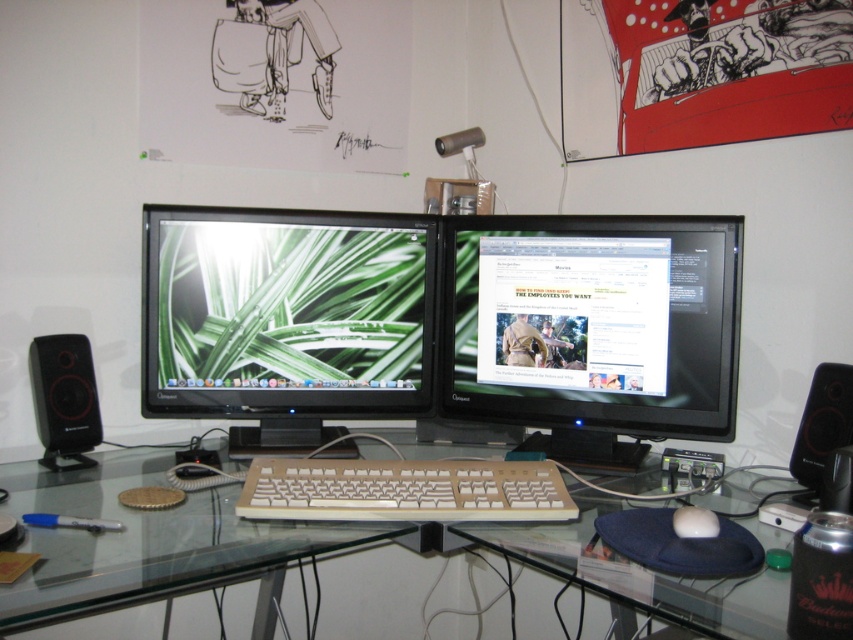
From the picture: You are a delivery robot that needs to place a package on the desk without blocking the camera. The package is 0.5 meters long. Can you place it between the black glossy monitor at center and the camera?

The distance between the black glossy monitor at center and the camera is 1.27 meters. Since the package is only 0.5 meters long, there is enough space to place it between them without blocking the camera.

In the scene shown: You are setting up a new monitor stand that requires the monitor to be no thicker than 3 cm. You have two monitors available, the black glossy monitor at center and the green matte monitor at center. Which monitor would be suitable for the stand based on their thickness?

The black glossy monitor at center is thinner than the green matte monitor at center, so the black glossy monitor at center would be suitable for the stand as it meets the thickness requirement.

What is the coordinate of the transparent glass desk at center?

The transparent glass desk at center is located at coordinate point (206, 540).